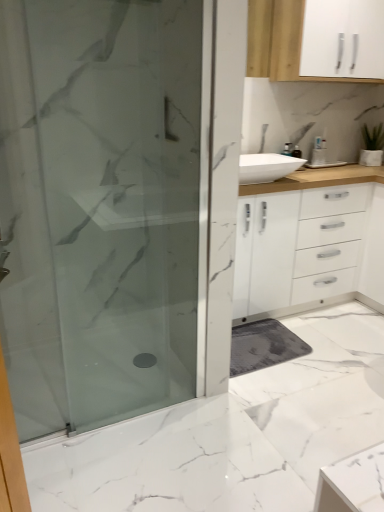
Identify the location of free space to the right of frosted glass shower door at left. The height and width of the screenshot is (512, 384). (208, 432).